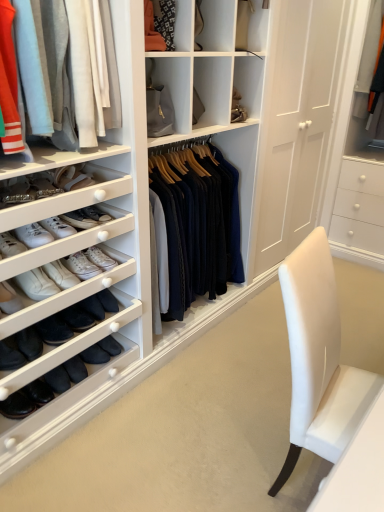
Find the location of a particular element. Image resolution: width=384 pixels, height=512 pixels. matte orange fabric at upper center is located at coordinates (233, 26).

The height and width of the screenshot is (512, 384). I want to click on light gray cotton pants at upper left, so click(82, 70).

Measure the distance between light gray cotton pants at upper left and camera.

4.05 feet.

Where is `white leather sneakers at left`? white leather sneakers at left is located at coordinates (10, 245).

Can we say light gray cotton pants at upper left lies outside matte orange fabric at upper center?

light gray cotton pants at upper left lies outside matte orange fabric at upper center's area.

From the image's perspective, which is below, light gray cotton pants at upper left or matte orange fabric at upper center?

light gray cotton pants at upper left, from the image's perspective.

Locate an element on the screen. This screenshot has height=512, width=384. shelf lying behind the light gray cotton pants at upper left is located at coordinates (233, 26).

Measure the distance from matte orange fabric at upper center to white leather sneakers at left.

The distance of matte orange fabric at upper center from white leather sneakers at left is 4.38 feet.

Considering the positions of points (177, 30) and (3, 243), is point (177, 30) farther from camera compared to point (3, 243)?

That is True.

From the image's perspective, does matte orange fabric at upper center appear higher than white leather sneakers at left?

Yes, from the image's perspective, matte orange fabric at upper center is above white leather sneakers at left.

Is the surface of matte orange fabric at upper center in direct contact with white leather sneakers at left?

No, matte orange fabric at upper center is not next to white leather sneakers at left.

Is matte orange fabric at upper center positioned with its back to light gray cotton pants at upper left?

matte orange fabric at upper center does not have its back to light gray cotton pants at upper left.

Which is closer, [243,15] or [65,117]?

Point [65,117]

Considering the relative sizes of matte orange fabric at upper center and light gray cotton pants at upper left in the image provided, is matte orange fabric at upper center wider than light gray cotton pants at upper left?

No, matte orange fabric at upper center is not wider than light gray cotton pants at upper left.

Does matte orange fabric at upper center have a larger size compared to light gray cotton pants at upper left?

Incorrect, matte orange fabric at upper center is not larger than light gray cotton pants at upper left.

Considering the relative positions of white leather sneakers at left and matte orange fabric at upper center in the image provided, is white leather sneakers at left to the left of matte orange fabric at upper center from the viewer's perspective?

Yes.

Considering the points (4, 252) and (260, 3), which point is behind, point (4, 252) or point (260, 3)?

The point (260, 3) is behind.

Considering the sizes of white leather sneakers at left and matte orange fabric at upper center in the image, is white leather sneakers at left bigger or smaller than matte orange fabric at upper center?

Clearly, white leather sneakers at left is smaller in size than matte orange fabric at upper center.

Based on their sizes in the image, would you say white leather sneakers at left is bigger or smaller than light gray cotton pants at upper left?

white leather sneakers at left is smaller than light gray cotton pants at upper left.

How many degrees apart are the facing directions of white leather sneakers at left and light gray cotton pants at upper left?

There is a 2.72-degree angle between the facing directions of white leather sneakers at left and light gray cotton pants at upper left.

Locate an element on the screen. footwear behind the light gray cotton pants at upper left is located at coordinates (10, 245).

From the image's perspective, which one is positioned lower, white leather sneakers at left or light gray cotton pants at upper left?

white leather sneakers at left.

Considering the relative sizes of light gray cotton pants at upper left and white leather sneakers at left in the image provided, is light gray cotton pants at upper left shorter than white leather sneakers at left?

No.

Which object is positioned more to the right, light gray cotton pants at upper left or white leather sneakers at left?

From the viewer's perspective, light gray cotton pants at upper left appears more on the right side.

Which is in front, point (53, 52) or point (13, 255)?

The point (53, 52) is closer to the camera.

Can you confirm if light gray cotton pants at upper left is thinner than white leather sneakers at left?

No.

The height and width of the screenshot is (512, 384). I want to click on clothing on the left of matte orange fabric at upper center, so click(x=82, y=70).

Find the location of a particular element. footwear that appears below the matte orange fabric at upper center (from the image's perspective) is located at coordinates (10, 245).

Estimate the real-world distances between objects in this image. Which object is further from matte orange fabric at upper center, light gray cotton pants at upper left or white leather sneakers at left?

Among the two, white leather sneakers at left is located further to matte orange fabric at upper center.

Considering their positions, is matte orange fabric at upper center positioned further to light gray cotton pants at upper left than white leather sneakers at left?

Among the two, matte orange fabric at upper center is located further to light gray cotton pants at upper left.

Considering their positions, is light gray cotton pants at upper left positioned further to white leather sneakers at left than matte orange fabric at upper center?

matte orange fabric at upper center is further to white leather sneakers at left.

When comparing their distances from matte orange fabric at upper center, does white leather sneakers at left or light gray cotton pants at upper left seem closer?

The object closer to matte orange fabric at upper center is light gray cotton pants at upper left.

When comparing their distances from light gray cotton pants at upper left, does white leather sneakers at left or matte orange fabric at upper center seem further?

matte orange fabric at upper center.

From the image, which object appears to be nearer to white leather sneakers at left, matte orange fabric at upper center or light gray cotton pants at upper left?

light gray cotton pants at upper left is closer to white leather sneakers at left.

Identify the location of clothing between matte orange fabric at upper center and white leather sneakers at left vertically. This screenshot has height=512, width=384. (82, 70).